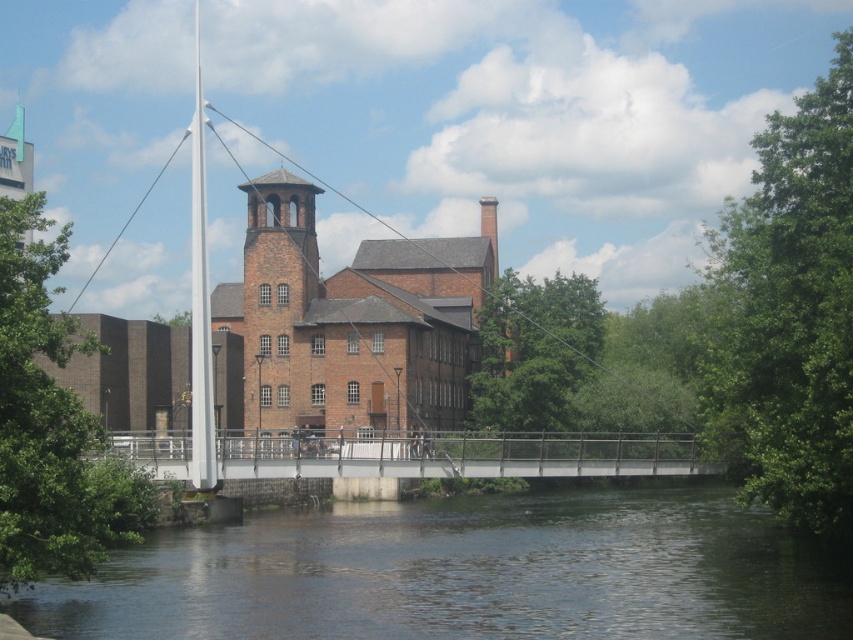
Based on the photo, who is shorter, brown brick tower at center or white glossy mast at center-left?

brown brick tower at center

Can you confirm if brown brick tower at center is taller than white glossy mast at center-left?

No.

Does point (302, 237) lie behind point (212, 392)?

That is True.

Where is `brown brick tower at center`? The height and width of the screenshot is (640, 853). brown brick tower at center is located at coordinates (280, 305).

Between dark brown water at lower center and metallic gray bridge at center, which one appears on the left side from the viewer's perspective?

Positioned to the left is metallic gray bridge at center.

Can you confirm if dark brown water at lower center is bigger than metallic gray bridge at center?

No, dark brown water at lower center is not bigger than metallic gray bridge at center.

Is point (769, 579) closer to viewer compared to point (526, 476)?

Yes, point (769, 579) is in front of point (526, 476).

At what (x,y) coordinates should I click in order to perform the action: click on dark brown water at lower center. Please return your answer as a coordinate pair (x, y). The width and height of the screenshot is (853, 640). Looking at the image, I should click on (468, 573).

Can you confirm if metallic gray bridge at center is shorter than white glossy mast at center-left?

Yes.

Between metallic gray bridge at center and white glossy mast at center-left, which one has less height?

With less height is metallic gray bridge at center.

Which is behind, point (599, 451) or point (199, 74)?

Point (199, 74)

You are a GUI agent. You are given a task and a screenshot of the screen. Output one action in this format:
    pyautogui.click(x=<x>, y=<y>)
    Task: Click on the metallic gray bridge at center
    
    Given the screenshot: What is the action you would take?
    pyautogui.click(x=456, y=454)